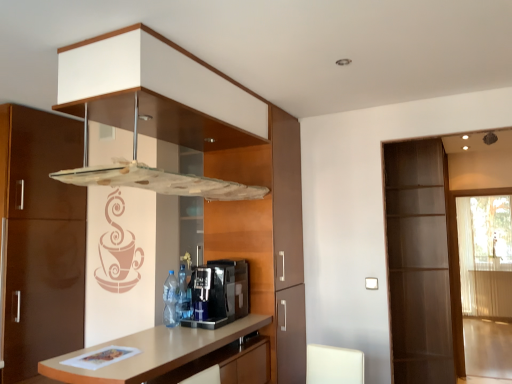
Image resolution: width=512 pixels, height=384 pixels. I want to click on free location above light brown wood countertop at center (from a real-world perspective), so click(176, 336).